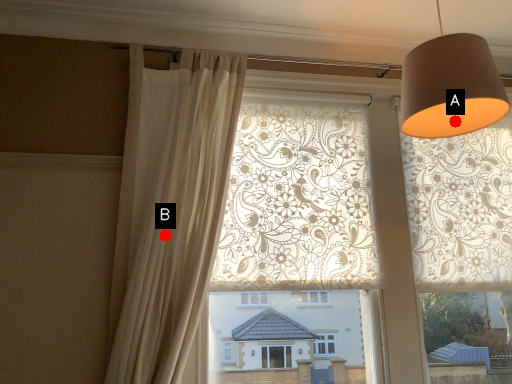
Question: Two points are circled on the image, labeled by A and B beside each circle. Which point is closer to the camera?

Choices:
 (A) A is closer
 (B) B is closer

Answer: (A)